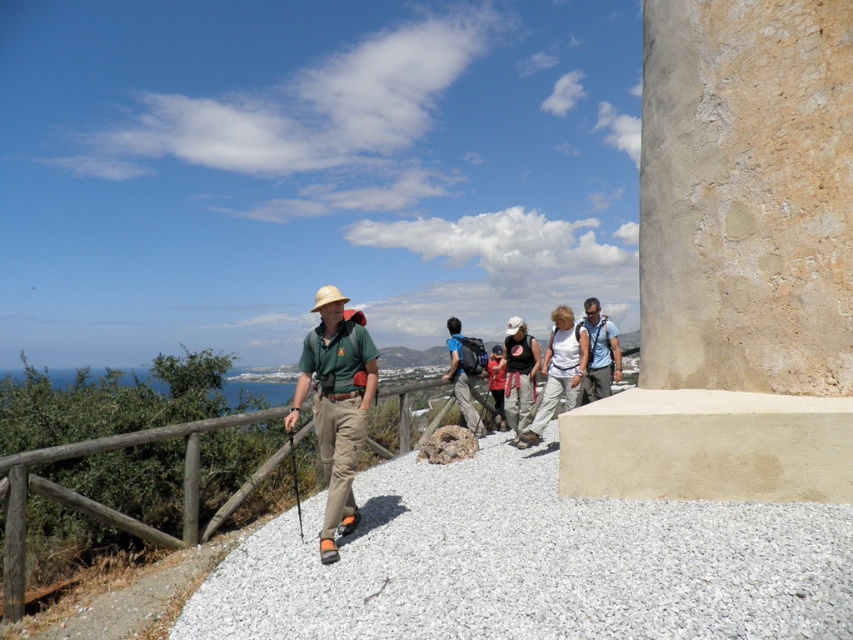
Question: Is smooth concrete pillar at right wider than wooden at left?

Choices:
 (A) yes
 (B) no

Answer: (A)

Question: Considering the relative positions of smooth concrete pillar at right and matte red backpack at center in the image provided, where is smooth concrete pillar at right located with respect to matte red backpack at center?

Choices:
 (A) below
 (B) above

Answer: (B)

Question: Which object appears farthest from the camera in this image?

Choices:
 (A) matte green shirt at center
 (B) matte blue shirt at center

Answer: (B)

Question: Which of the following is the closest to the observer?

Choices:
 (A) wooden at left
 (B) matte red backpack at center
 (C) matte black tank top at center

Answer: (A)

Question: Does matte green shirt at center have a greater width compared to matte red backpack at center?

Choices:
 (A) no
 (B) yes

Answer: (B)

Question: Which point is closer to the camera?

Choices:
 (A) (709, 216)
 (B) (502, 403)
 (C) (605, 333)

Answer: (A)